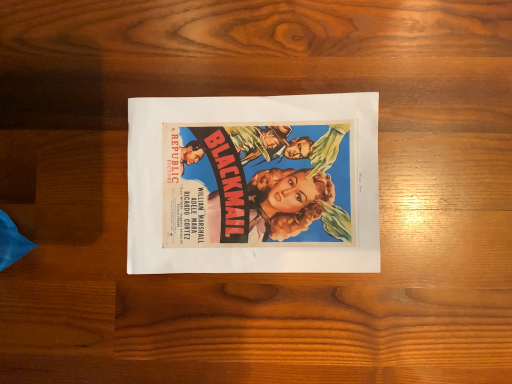
At what (x,y) coordinates should I click in order to perform the action: click on vacant region above vivid paper poster at center (from a real-world perspective). Please return your answer as a coordinate pair (x, y). This screenshot has height=384, width=512. Looking at the image, I should click on (264, 185).